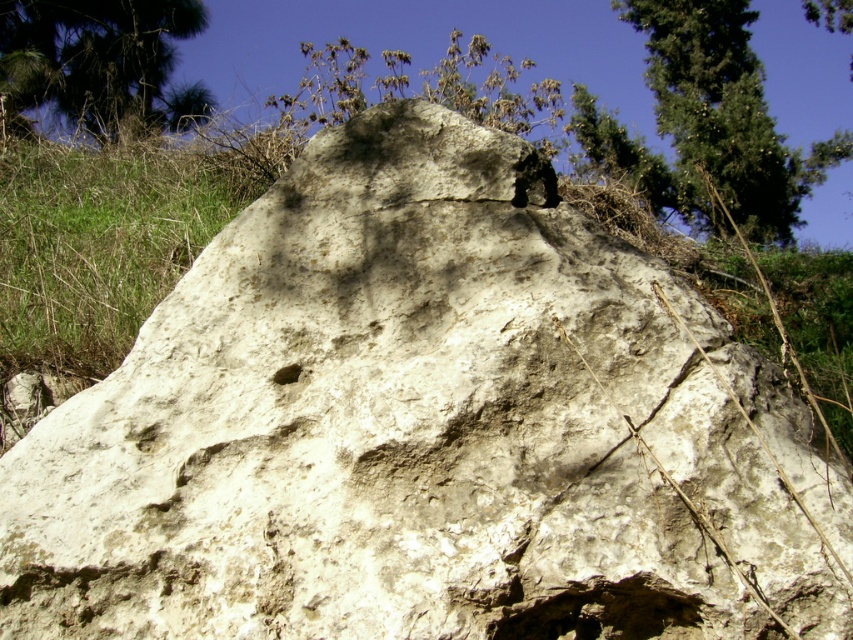
Question: Observing the image, what is the correct spatial positioning of green leafy tree at upper right in reference to green leafy tree at upper left?

Choices:
 (A) below
 (B) above

Answer: (B)

Question: Which of the following is the closest to the observer?

Choices:
 (A) (109, 131)
 (B) (708, 168)

Answer: (A)

Question: Does green leafy tree at upper right have a larger size compared to green leafy tree at upper left?

Choices:
 (A) no
 (B) yes

Answer: (B)

Question: Among these points, which one is nearest to the camera?

Choices:
 (A) (631, 20)
 (B) (77, 125)

Answer: (B)

Question: Does green leafy tree at upper right appear on the right side of green leafy tree at upper left?

Choices:
 (A) no
 (B) yes

Answer: (B)

Question: Among these objects, which one is farthest from the camera?

Choices:
 (A) green leafy tree at upper left
 (B) green leafy tree at upper right

Answer: (B)